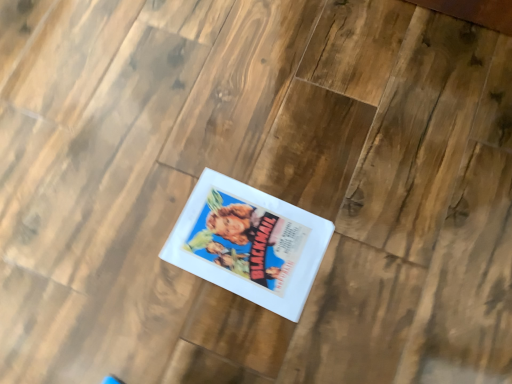
Where is `free region under white glossy paperback book at center (from a real-world perspective)`? This screenshot has width=512, height=384. free region under white glossy paperback book at center (from a real-world perspective) is located at coordinates (248, 242).